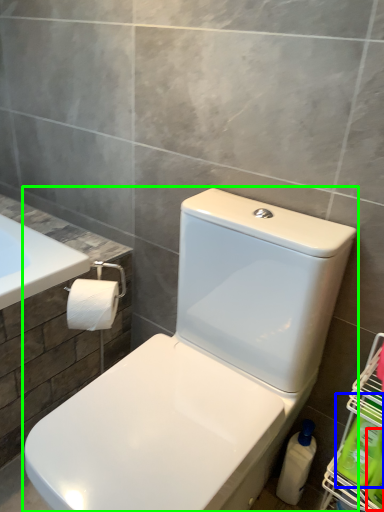
Question: Based on their relative distances, which object is nearer to cleaning product (highlighted by a red box)? Choose from cleaning product (highlighted by a blue box) and toilet (highlighted by a green box).

Choices:
 (A) cleaning product
 (B) toilet

Answer: (A)